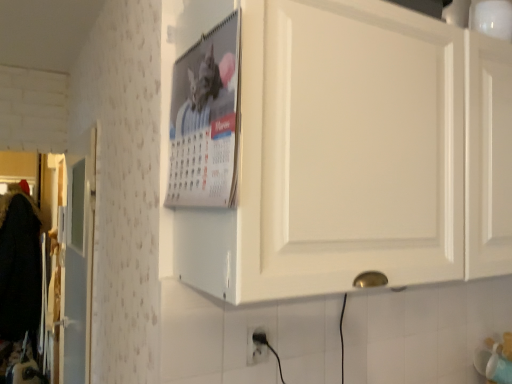
Question: Looking at their shapes, would you say white plastic electric outlet at lower center is wider or thinner than metallic silver calendar at upper center?

Choices:
 (A) wide
 (B) thin

Answer: (B)

Question: From the image's perspective, is white plastic electric outlet at lower center positioned above or below metallic silver calendar at upper center?

Choices:
 (A) above
 (B) below

Answer: (B)

Question: Estimate the real-world distances between objects in this image. Which object is closer to the metallic silver calendar at upper center?

Choices:
 (A) white matte cabinet at upper center
 (B) white plastic electric outlet at lower center

Answer: (A)

Question: Estimate the real-world distances between objects in this image. Which object is closer to the white plastic electric outlet at lower center?

Choices:
 (A) metallic silver calendar at upper center
 (B) white matte cabinet at upper center

Answer: (A)